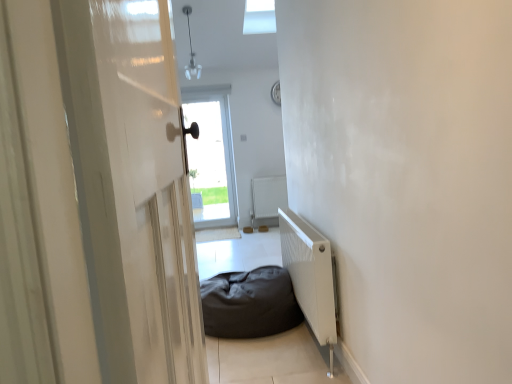
Question: Can you confirm if dark fabric bean bag at center is smaller than white matte radiator at center, which ranks as the second radiator in front-to-back order?

Choices:
 (A) yes
 (B) no

Answer: (B)

Question: Can you confirm if dark fabric bean bag at center is positioned to the right of white matte radiator at center, which ranks as the second radiator in front-to-back order?

Choices:
 (A) no
 (B) yes

Answer: (A)

Question: Is dark fabric bean bag at center to the left of white matte radiator at center, which ranks as the second radiator in front-to-back order, from the viewer's perspective?

Choices:
 (A) yes
 (B) no

Answer: (A)

Question: Can you confirm if dark fabric bean bag at center is thinner than white matte radiator at center, the 1th radiator in the back-to-front sequence?

Choices:
 (A) no
 (B) yes

Answer: (A)

Question: Does dark fabric bean bag at center have a greater height compared to white matte radiator at center, the 1th radiator in the back-to-front sequence?

Choices:
 (A) yes
 (B) no

Answer: (B)

Question: Considering the positions of transparent glass door at center and dark fabric bean bag at center in the image, is transparent glass door at center wider or thinner than dark fabric bean bag at center?

Choices:
 (A) wide
 (B) thin

Answer: (B)

Question: From the image's perspective, relative to dark fabric bean bag at center, is transparent glass door at center above or below?

Choices:
 (A) above
 (B) below

Answer: (A)

Question: Considering the relative positions of transparent glass door at center and dark fabric bean bag at center in the image provided, is transparent glass door at center to the left or to the right of dark fabric bean bag at center?

Choices:
 (A) right
 (B) left

Answer: (B)

Question: From a real-world perspective, is transparent glass door at center physically located above or below dark fabric bean bag at center?

Choices:
 (A) above
 (B) below

Answer: (A)

Question: Considering the positions of white matte radiator at lower right, arranged as the 1th radiator when viewed from the front, and dark fabric bean bag at center in the image, is white matte radiator at lower right, arranged as the 1th radiator when viewed from the front, wider or thinner than dark fabric bean bag at center?

Choices:
 (A) wide
 (B) thin

Answer: (B)

Question: Is white matte radiator at lower right, acting as the second radiator starting from the back, taller or shorter than dark fabric bean bag at center?

Choices:
 (A) tall
 (B) short

Answer: (A)

Question: From the image's perspective, is white matte radiator at lower right, arranged as the 1th radiator when viewed from the front, positioned above or below dark fabric bean bag at center?

Choices:
 (A) below
 (B) above

Answer: (B)

Question: From a real-world perspective, is white matte radiator at lower right, arranged as the 1th radiator when viewed from the front, physically located above or below dark fabric bean bag at center?

Choices:
 (A) below
 (B) above

Answer: (B)

Question: In terms of height, does white glossy door at left look taller or shorter compared to dark fabric bean bag at center?

Choices:
 (A) short
 (B) tall

Answer: (B)

Question: From a real-world perspective, is white glossy door at left above or below dark fabric bean bag at center?

Choices:
 (A) above
 (B) below

Answer: (A)